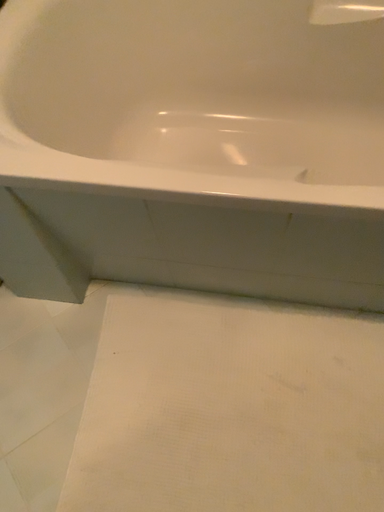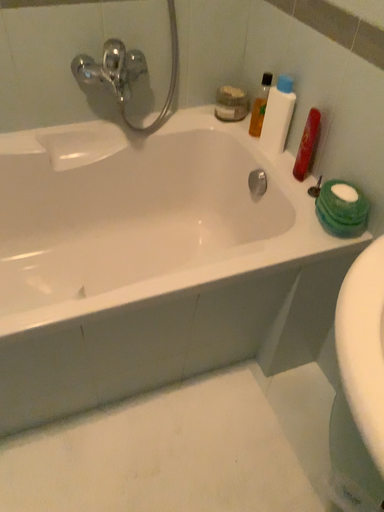
Question: How did the camera likely rotate when shooting the video?

Choices:
 (A) rotated left
 (B) rotated right

Answer: (B)